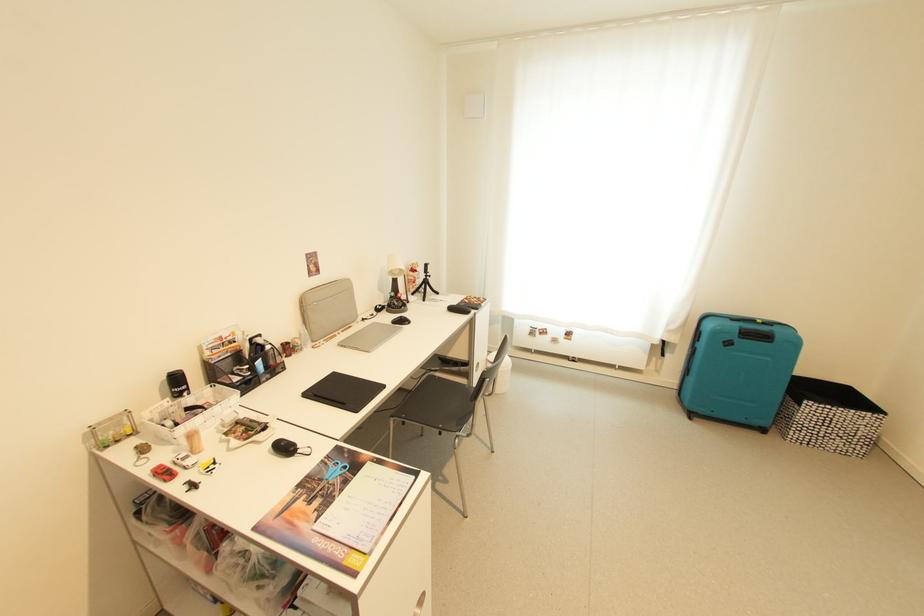
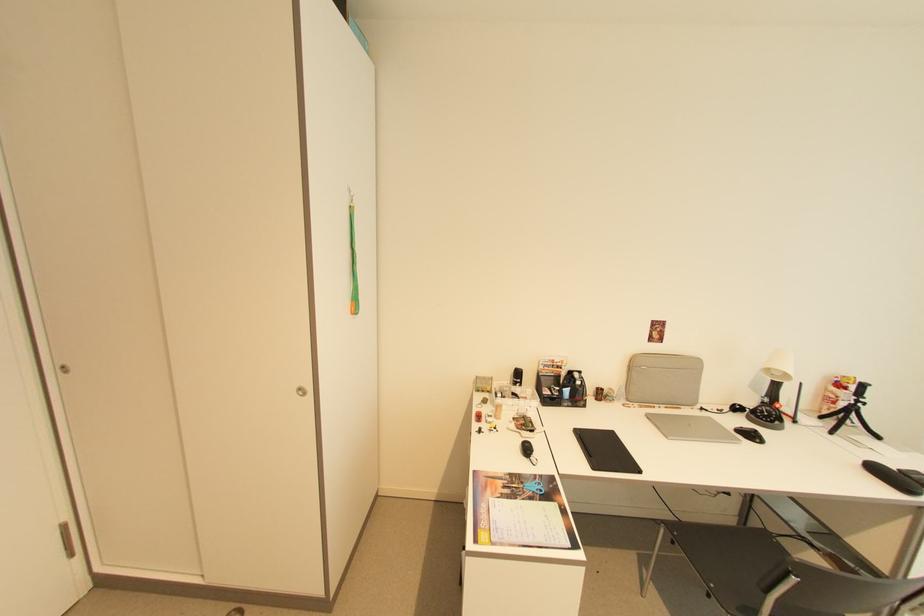
Locate, in the second image, the point that corresponds to pixel 407 424 in the first image.

(677, 541)